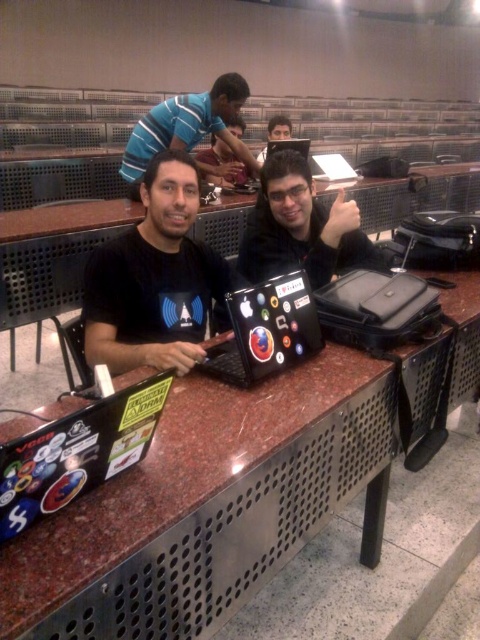
Who is positioned more to the left, black matte shirt at center or glossy black laptop at center?

Positioned to the left is black matte shirt at center.

Based on the photo, can you confirm if black matte shirt at center is positioned to the left of glossy black laptop at center?

Indeed, black matte shirt at center is positioned on the left side of glossy black laptop at center.

Which is behind, point (144, 323) or point (300, 148)?

Point (300, 148)

At what (x,y) coordinates should I click in order to perform the action: click on black matte shirt at center. Please return your answer as a coordinate pair (x, y). Image resolution: width=480 pixels, height=640 pixels. Looking at the image, I should click on (155, 280).

Can you confirm if black matte shirt at center is bigger than matte black laptop at center?

Yes.

Describe the element at coordinates (155, 280) in the screenshot. Image resolution: width=480 pixels, height=640 pixels. I see `black matte shirt at center` at that location.

Identify the location of black matte shirt at center. This screenshot has height=640, width=480. (155, 280).

Is black matte shirt at center thinner than blue striped shirt at upper center?

Indeed, black matte shirt at center has a lesser width compared to blue striped shirt at upper center.

Is the position of black matte shirt at center less distant than that of blue striped shirt at upper center?

Yes, black matte shirt at center is in front of blue striped shirt at upper center.

This screenshot has height=640, width=480. I want to click on black matte shirt at center, so click(155, 280).

The image size is (480, 640). I want to click on black matte shirt at center, so click(155, 280).